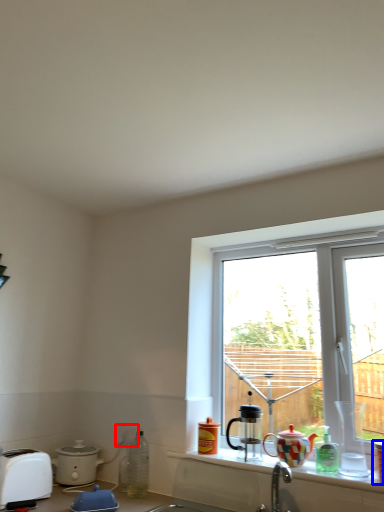
Question: Among these objects, which one is nearest to the camera, electric outlet (highlighted by a red box) or coffee cup (highlighted by a blue box)?

Choices:
 (A) electric outlet
 (B) coffee cup

Answer: (B)